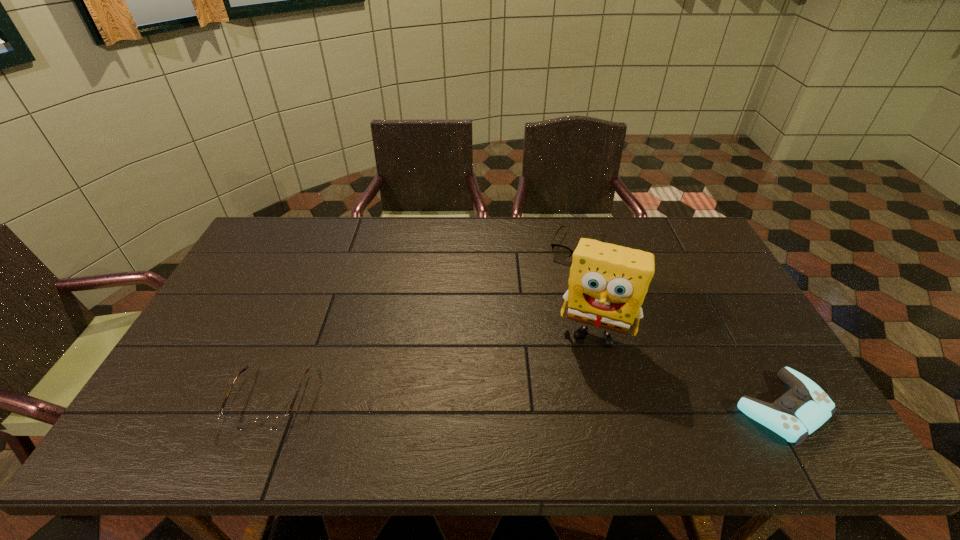
Locate an element on the screen. This screenshot has width=960, height=540. vacant space that satisfies the following two spatial constraints: 1. on the front-facing side of the nearer spectacles; 2. on the right side of the rightmost object is located at coordinates (268, 408).